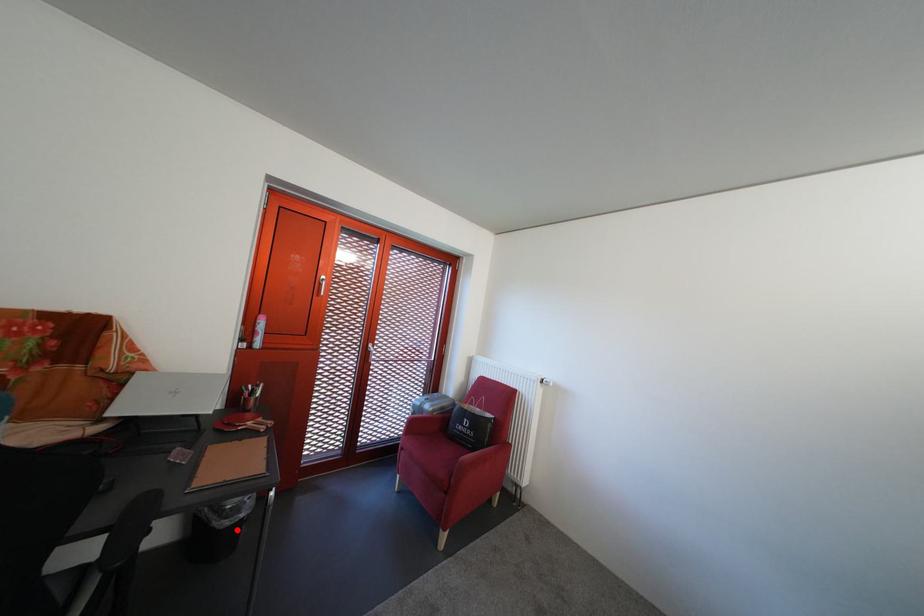
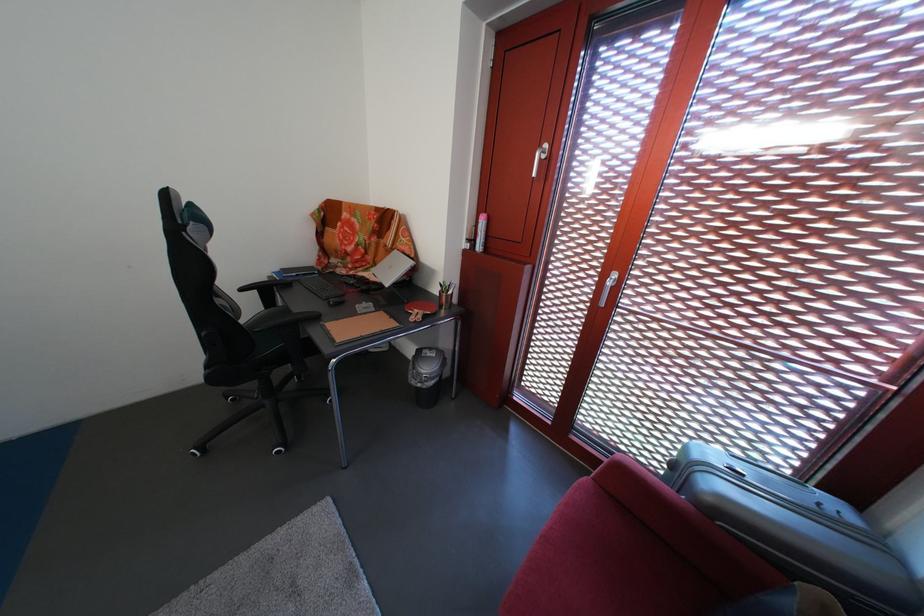
Locate, in the second image, the point that corresponds to the highlighted location in the first image.

(424, 389)